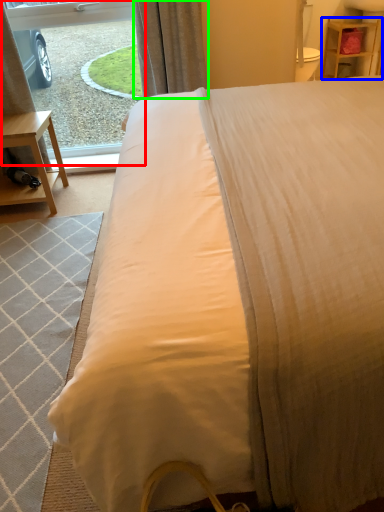
Question: Which object is the closest to the window screen (highlighted by a red box)? Choose among these: nightstand (highlighted by a blue box) or curtain (highlighted by a green box).

Choices:
 (A) nightstand
 (B) curtain

Answer: (B)